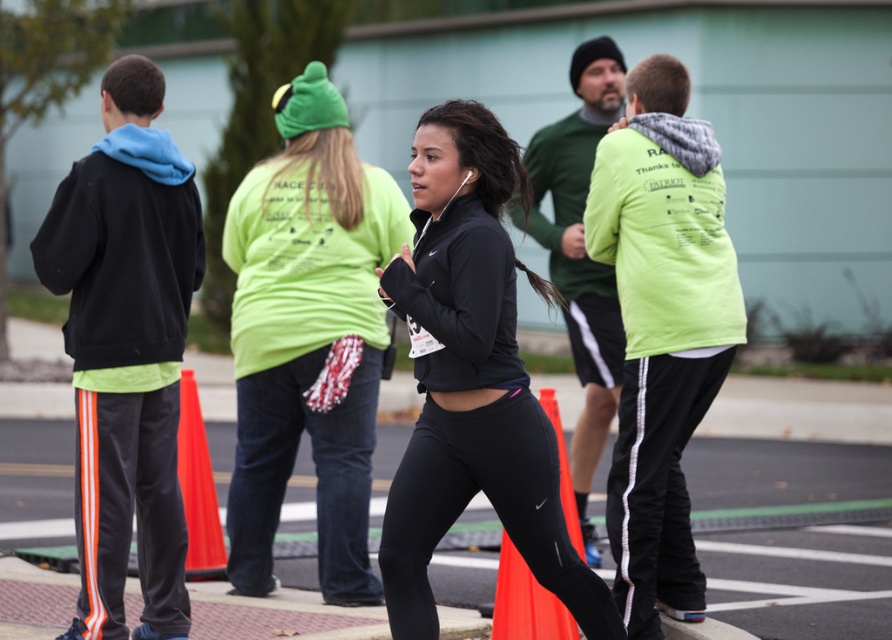
Does black matte leggings at center have a greater width compared to orange fabric traffic cone at lower center?

Indeed, black matte leggings at center has a greater width compared to orange fabric traffic cone at lower center.

Who is positioned more to the right, black matte leggings at center or orange fabric traffic cone at lower center?

From the viewer's perspective, orange fabric traffic cone at lower center appears more on the right side.

Is point (398, 570) positioned before point (534, 634)?

Yes.

I want to click on black matte leggings at center, so click(492, 506).

Is matte black leggings at center above orange fabric traffic cone at lower center?

Yes, matte black leggings at center is above orange fabric traffic cone at lower center.

In the scene shown: Does matte black leggings at center have a greater width compared to orange fabric traffic cone at lower center?

Yes, matte black leggings at center is wider than orange fabric traffic cone at lower center.

Is point (403, 477) closer to viewer compared to point (547, 621)?

Yes, point (403, 477) is in front of point (547, 621).

Identify the location of matte black leggings at center. The height and width of the screenshot is (640, 892). (472, 380).

Based on the photo, who is more distant from viewer, (350, 138) or (728, 262)?

Positioned behind is point (350, 138).

The height and width of the screenshot is (640, 892). What do you see at coordinates (308, 337) in the screenshot?
I see `matte black jacket at center` at bounding box center [308, 337].

This screenshot has height=640, width=892. I want to click on matte black jacket at center, so click(x=308, y=337).